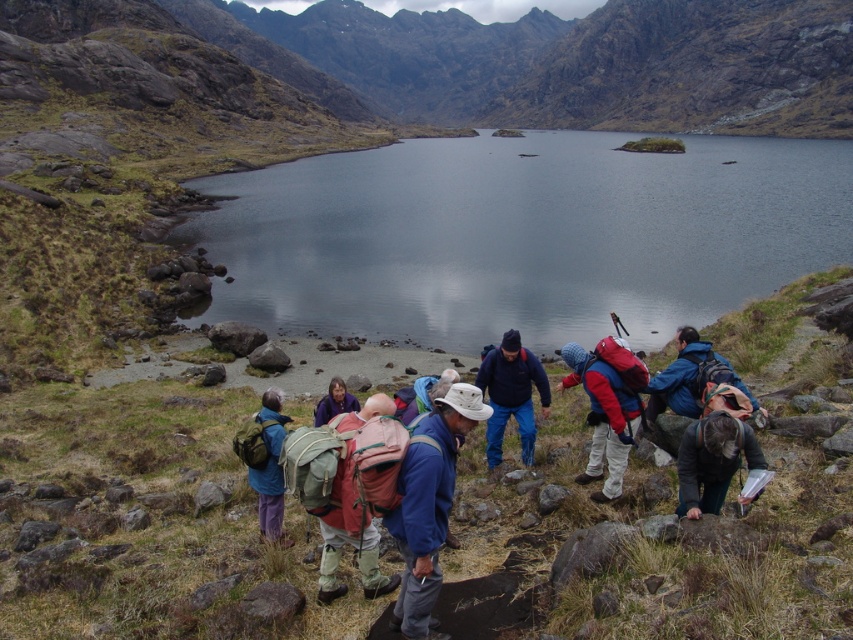
Which is in front, point (529, 384) or point (270, 445)?

Point (270, 445)

Does blue fleece jacket at center have a lesser width compared to matte green backpack at center?

No.

Between point (521, 376) and point (253, 440), which one is positioned behind?

The point (521, 376) is behind.

This screenshot has height=640, width=853. In order to click on blue fleece jacket at center in this screenshot , I will do `click(511, 394)`.

Who is positioned more to the left, smooth reflective water at center or blue fabric jacket at center?

blue fabric jacket at center

Is point (250, 248) positioned behind point (436, 579)?

Yes, point (250, 248) is farther from viewer.

You are a GUI agent. You are given a task and a screenshot of the screen. Output one action in this format:
    pyautogui.click(x=<x>, y=<y>)
    Task: Click on the smooth reflective water at center
    Image resolution: width=853 pixels, height=640 pixels.
    Given the screenshot: What is the action you would take?
    pyautogui.click(x=521, y=236)

Measure the distance from matte green backpack at center to matte purple jacket at center.

The distance of matte green backpack at center from matte purple jacket at center is 25.07 feet.

Between point (271, 536) and point (328, 416), which one is positioned behind?

The point (328, 416) is behind.

The image size is (853, 640). In order to click on matte green backpack at center in this screenshot , I will do `click(265, 461)`.